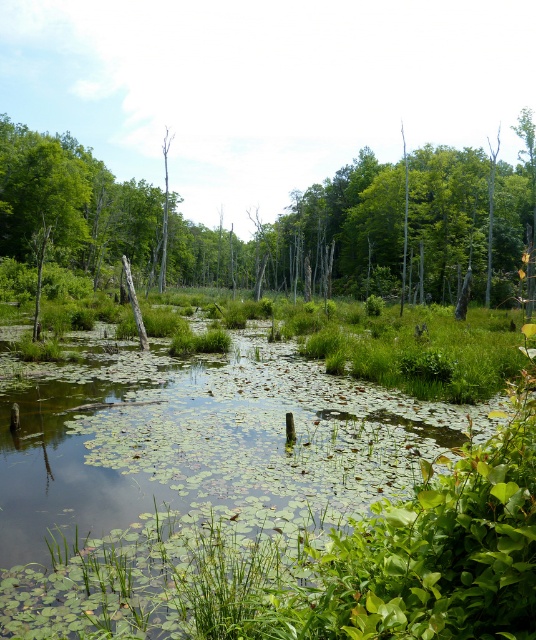
Can you confirm if green leafy vegetation at center is positioned to the left of green matte tree at center?

No, green leafy vegetation at center is not to the left of green matte tree at center.

Does green leafy vegetation at center have a smaller size compared to green matte tree at center?

Yes.

Who is more distant from viewer, (294,419) or (319,208)?

Positioned behind is point (319,208).

Locate an element on the screen. The image size is (536, 640). green leafy vegetation at center is located at coordinates (259, 500).